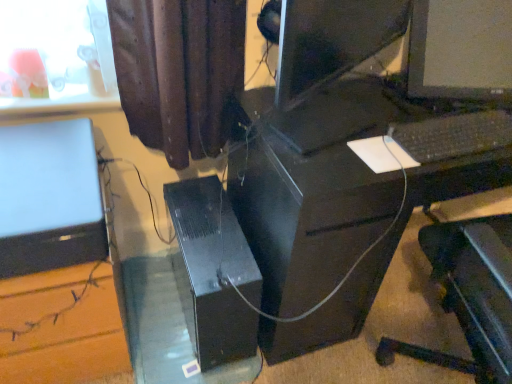
Question: Is black plastic computer desk at center at the back of black plastic computer tower at center?

Choices:
 (A) no
 (B) yes

Answer: (A)

Question: Does black plastic computer tower at center lie in front of black plastic computer desk at center?

Choices:
 (A) no
 (B) yes

Answer: (A)

Question: Considering the relative sizes of black plastic computer tower at center and black plastic computer desk at center in the image provided, is black plastic computer tower at center bigger than black plastic computer desk at center?

Choices:
 (A) yes
 (B) no

Answer: (B)

Question: From a real-world perspective, is black plastic computer tower at center located beneath black plastic computer desk at center?

Choices:
 (A) no
 (B) yes

Answer: (B)

Question: Could you tell me if black plastic computer tower at center is turned towards black plastic computer desk at center?

Choices:
 (A) yes
 (B) no

Answer: (B)

Question: Is black plastic computer tower at center thinner than black plastic computer desk at center?

Choices:
 (A) yes
 (B) no

Answer: (A)

Question: Is black plastic computer tower at center at the back of black plastic computer desk at center?

Choices:
 (A) no
 (B) yes

Answer: (A)

Question: Does black plastic computer desk at center appear on the left side of black plastic computer tower at center?

Choices:
 (A) yes
 (B) no

Answer: (B)

Question: From a real-world perspective, is black plastic computer desk at center positioned over black plastic computer tower at center based on gravity?

Choices:
 (A) yes
 (B) no

Answer: (A)

Question: Is black plastic computer desk at center next to black plastic computer tower at center and touching it?

Choices:
 (A) yes
 (B) no

Answer: (B)

Question: Is black plastic computer desk at center outside of black plastic computer tower at center?

Choices:
 (A) yes
 (B) no

Answer: (A)

Question: Considering the relative sizes of black plastic computer desk at center and black plastic computer tower at center in the image provided, is black plastic computer desk at center shorter than black plastic computer tower at center?

Choices:
 (A) no
 (B) yes

Answer: (A)

Question: Is black plastic computer tower at center not near satin silver laptop at left?

Choices:
 (A) no
 (B) yes

Answer: (A)